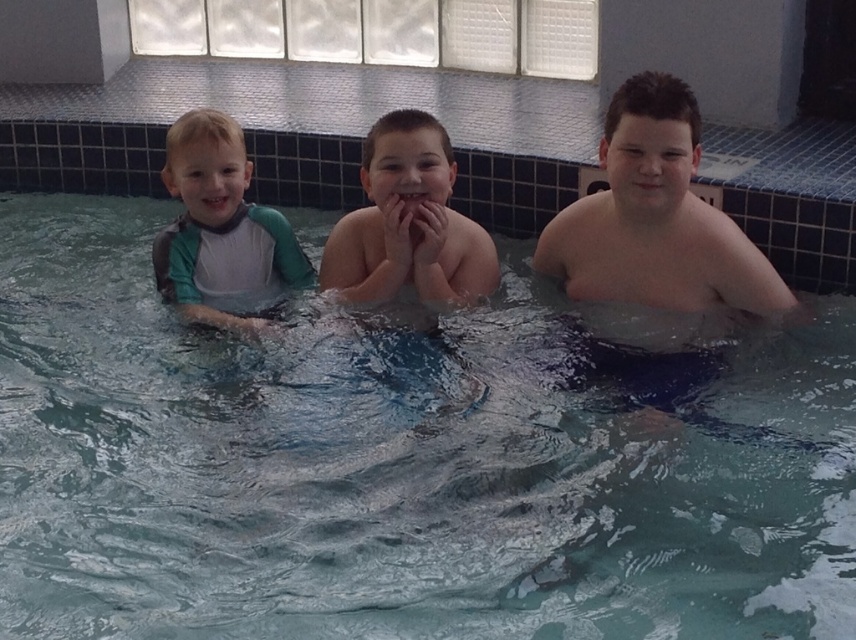
Is the position of clear blue water at center more distant than that of smooth skin boy at right?

No, clear blue water at center is in front of smooth skin boy at right.

The image size is (856, 640). Find the location of `clear blue water at center`. clear blue water at center is located at coordinates (397, 467).

You are a GUI agent. You are given a task and a screenshot of the screen. Output one action in this format:
    pyautogui.click(x=<x>, y=<y>)
    Task: Click on the clear blue water at center
    The image size is (856, 640).
    Given the screenshot: What is the action you would take?
    pyautogui.click(x=397, y=467)

This screenshot has width=856, height=640. What do you see at coordinates (397, 467) in the screenshot?
I see `clear blue water at center` at bounding box center [397, 467].

Does clear blue water at center have a greater width compared to green-gray wetsuit at left?

Indeed, clear blue water at center has a greater width compared to green-gray wetsuit at left.

What do you see at coordinates (397, 467) in the screenshot? I see `clear blue water at center` at bounding box center [397, 467].

Locate an element on the screen. clear blue water at center is located at coordinates (397, 467).

Which is behind, point (143, 557) or point (455, 292)?

Positioned behind is point (455, 292).

Which is more to the left, clear blue water at center or smooth skin child at center?

From the viewer's perspective, clear blue water at center appears more on the left side.

Between point (324, 481) and point (415, 170), which one is positioned in front?

Point (324, 481)

In order to click on clear blue water at center in this screenshot , I will do `click(397, 467)`.